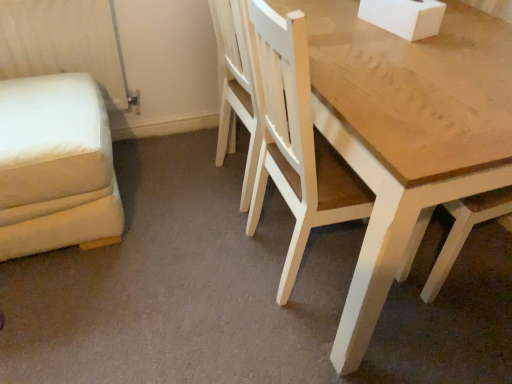
The width and height of the screenshot is (512, 384). Identify the location of free location in front of light wood chair at center. (292, 349).